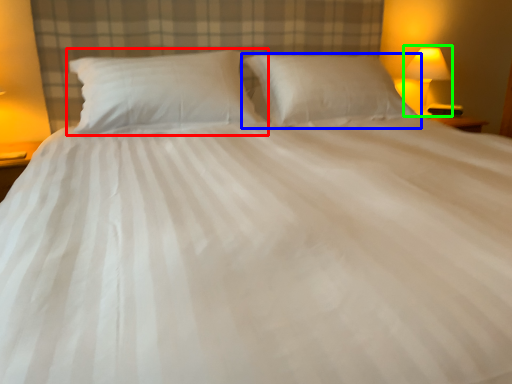
Question: Considering the real-world distances, which object is farthest from pillow (highlighted by a red box)? pillow (highlighted by a blue box) or bedside lamp (highlighted by a green box)?

Choices:
 (A) pillow
 (B) bedside lamp

Answer: (B)